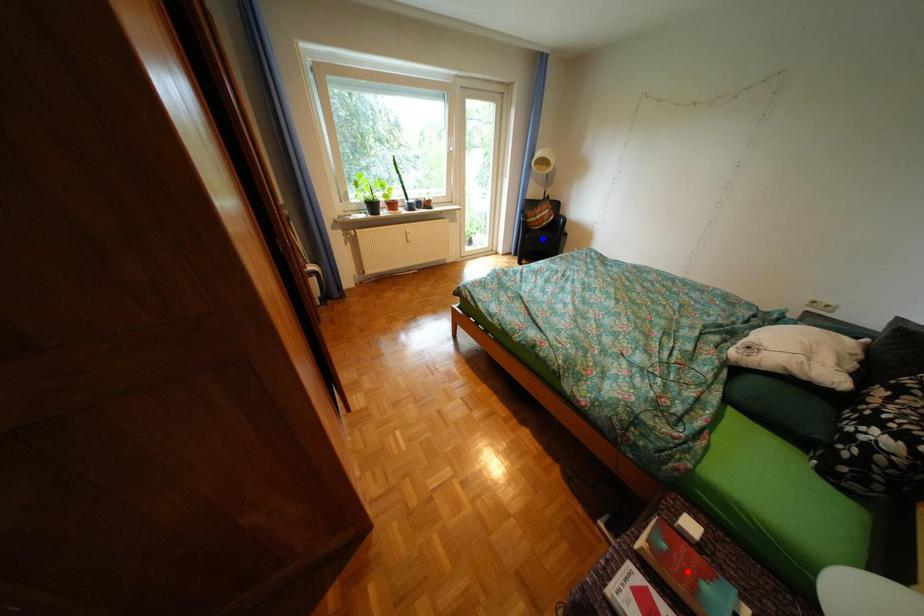
Question: In the image, two points are highlighted. Which point is nearer to the camera? Reply with the corresponding letter.

Choices:
 (A) blue point
 (B) red point

Answer: (B)